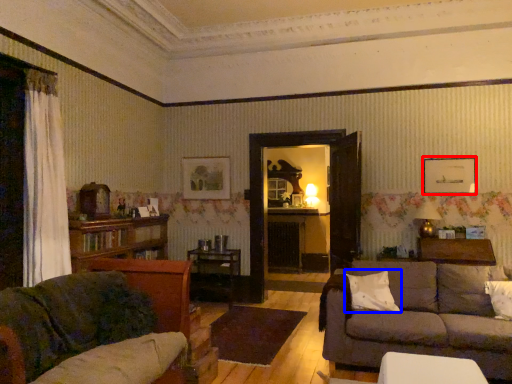
Question: Which of the following is the farthest to the observer, picture frame (highlighted by a red box) or pillow (highlighted by a blue box)?

Choices:
 (A) picture frame
 (B) pillow

Answer: (A)